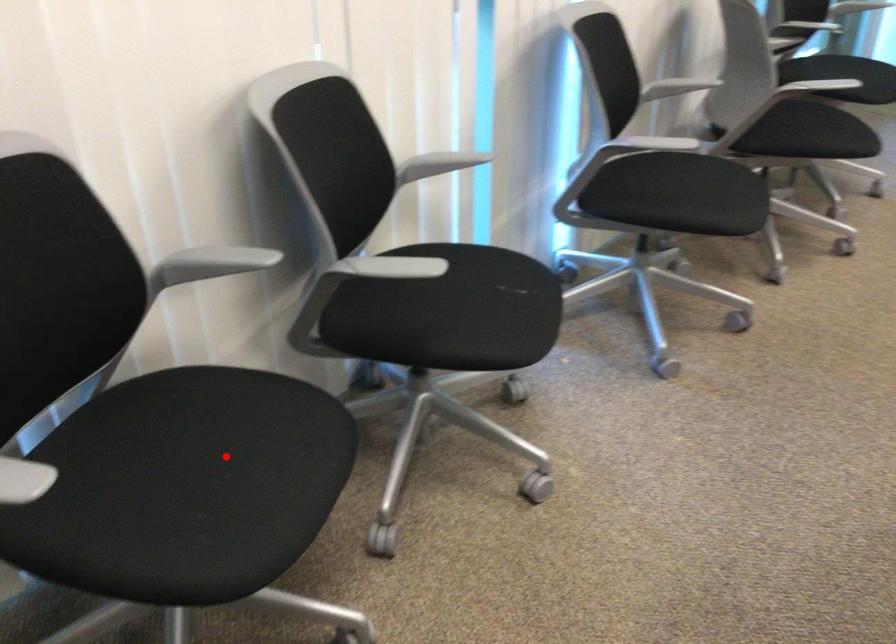
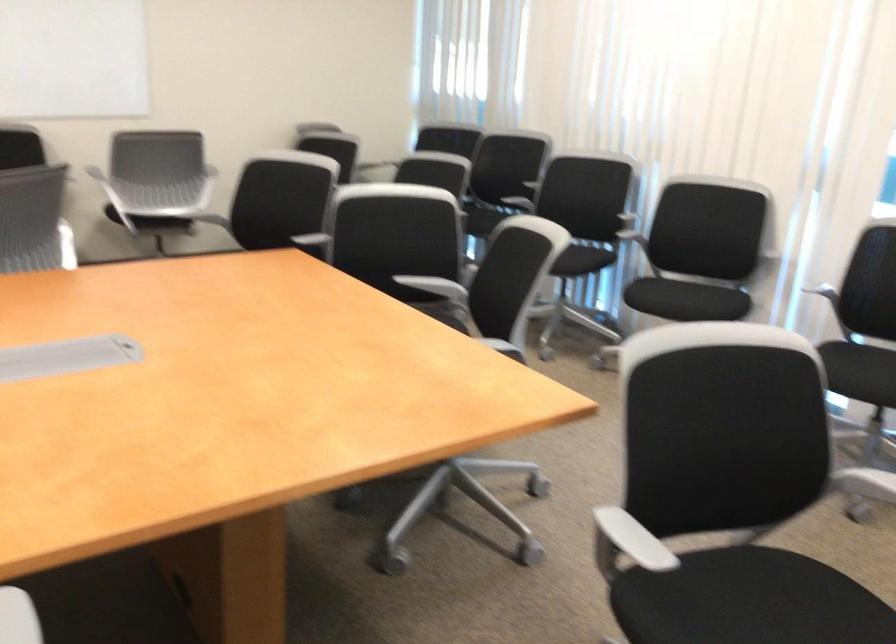
Question: I am providing you with two images of the same scene from different viewpoints. A red point is marked on the first image. At the location where the point appears in image 1, is it still visible in image 2?

Choices:
 (A) Yes
 (B) No

Answer: (B)